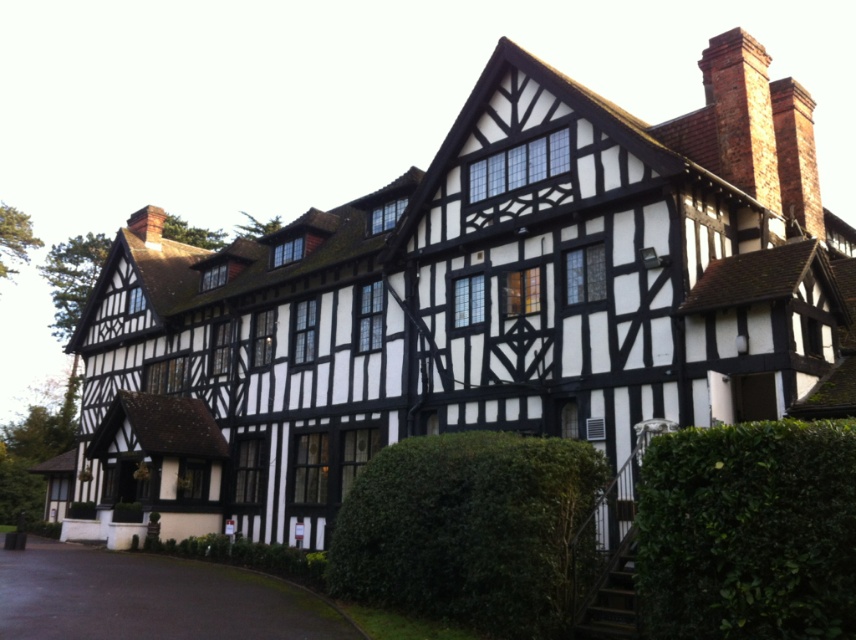
Question: Among these objects, which one is farthest from the camera?

Choices:
 (A) green leafy hedge at center
 (B) black asphalt driveway at lower left
 (C) green leafy hedge at lower right

Answer: (A)

Question: Which point is closer to the camera?

Choices:
 (A) brick chimney at upper right
 (B) green leafy hedge at center
 (C) black asphalt driveway at lower left

Answer: (C)

Question: In this image, where is green leafy hedge at lower right located relative to red brick chimney at upper right?

Choices:
 (A) above
 (B) below

Answer: (B)

Question: Does black asphalt driveway at lower left have a lesser width compared to red brick chimney at upper right?

Choices:
 (A) yes
 (B) no

Answer: (B)

Question: Which point is farther to the camera?

Choices:
 (A) red brick chimney at upper right
 (B) green leafy hedge at center
 (C) black asphalt driveway at lower left

Answer: (A)

Question: Does green leafy hedge at lower right appear under brick chimney at upper right?

Choices:
 (A) yes
 (B) no

Answer: (A)